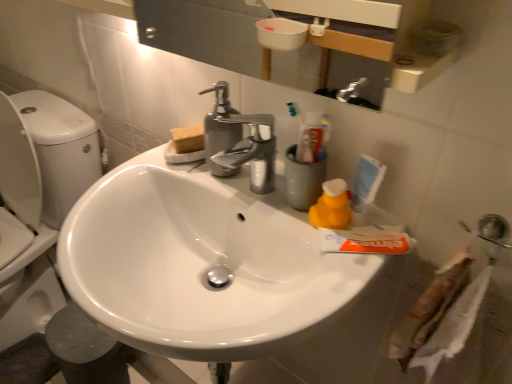
I want to click on blank area to the left of satin nickel faucet at upper center, the first plumbing fixture when ordered from back to front, so click(145, 173).